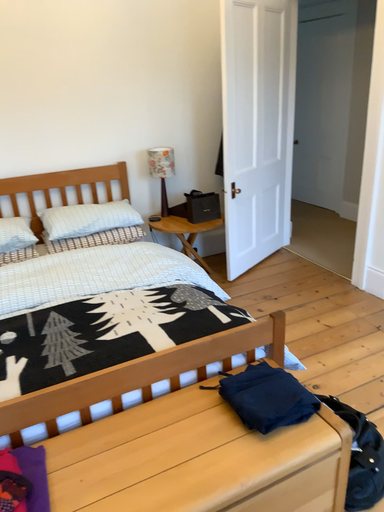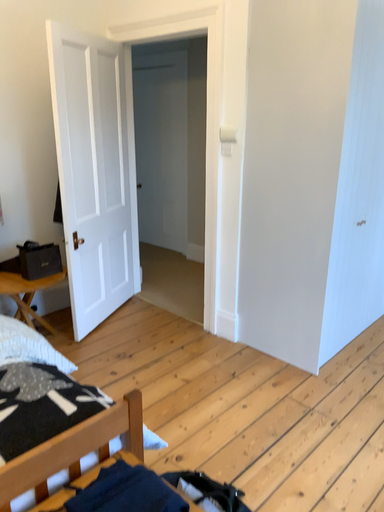
Question: Which way did the camera rotate in the video?

Choices:
 (A) rotated left
 (B) rotated right

Answer: (B)